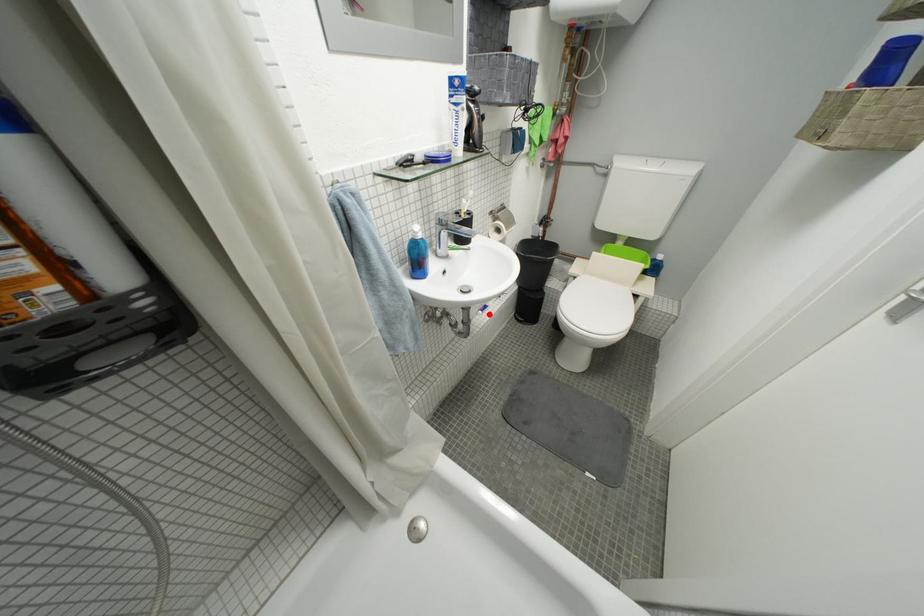
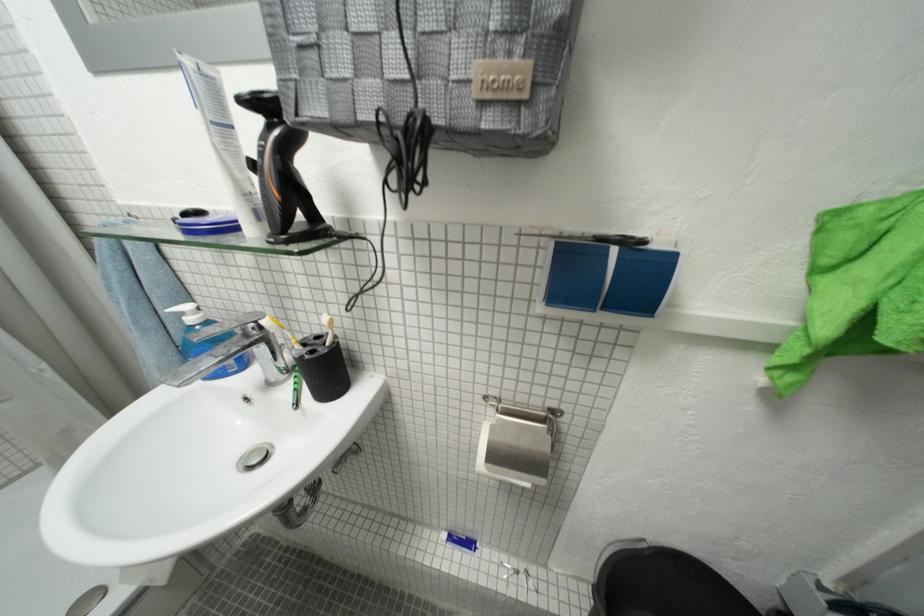
Locate, in the second image, the point that corresponds to the highlighted location in the first image.

(454, 538)